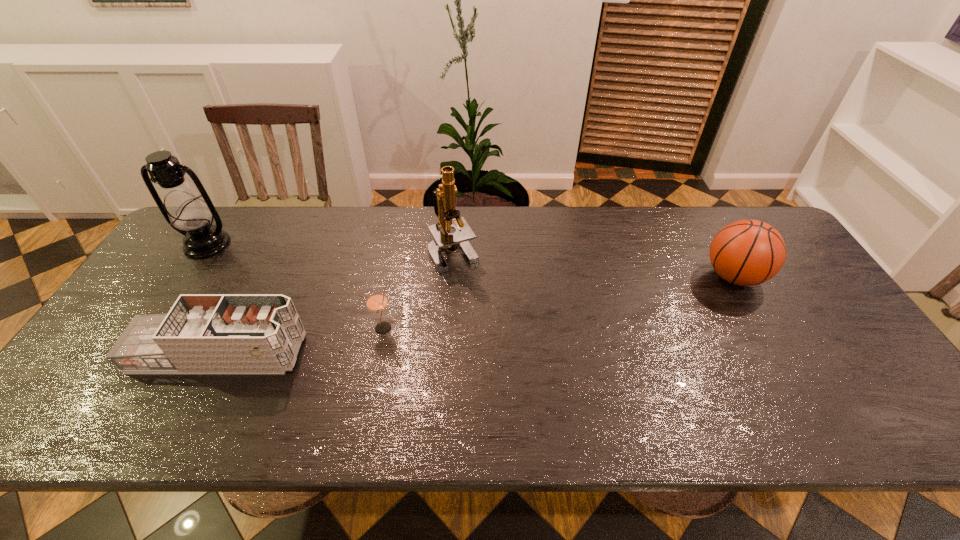
Identify the location of oil lamp. This screenshot has width=960, height=540. (184, 209).

Locate an element on the screen. The image size is (960, 540). the fourth object from left to right is located at coordinates (444, 197).

I want to click on the rightmost object, so click(747, 252).

Locate an element on the screen. Image resolution: width=960 pixels, height=540 pixels. straw is located at coordinates (376, 301).

Identify the location of dollhouse. This screenshot has height=540, width=960. (213, 333).

Where is `free space located on the front of the oil lamp`? free space located on the front of the oil lamp is located at coordinates (190, 271).

Find the location of a particular element. The image size is (960, 540). vacant space positioned at the eyepiece of the microscope is located at coordinates (448, 328).

Image resolution: width=960 pixels, height=540 pixels. In order to click on vacant space located on the back of the rightmost object in this screenshot , I will do `click(706, 229)`.

Where is `vacant space situated 0.110m on the front of the straw`? The height and width of the screenshot is (540, 960). vacant space situated 0.110m on the front of the straw is located at coordinates (375, 373).

Identify the location of vacant space located at the entrance of the dollhouse. (358, 353).